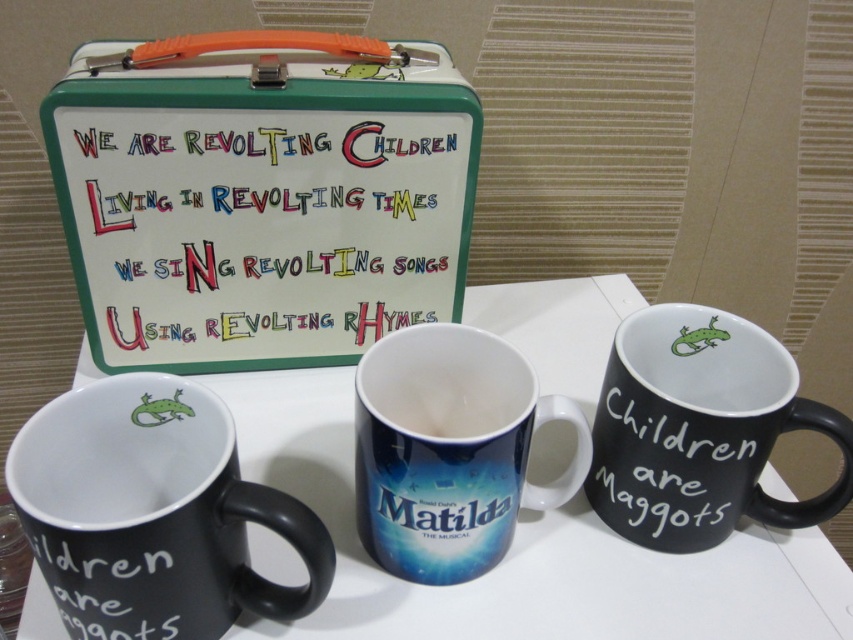
What is the color of the mug located at point (521, 552)?

The black matte mugs at center is located at point (521, 552), so the color is black.

You are setting up a table for a tea party and need to choose between the black matte mugs at center and the matte ceramic mug at center. Which mug should you pick if you want the taller one for serving taller beverages?

The black matte mugs at center has a greater height compared to the matte ceramic mug at center, so you should choose the black matte mugs at center for serving taller beverages.